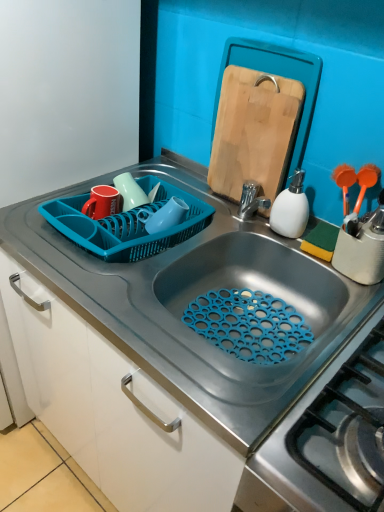
Question: Considering the relative sizes of matte red mug at upper left, acting as the first tableware starting from the left, and matte ceramic mugs at upper center, which appears as the first tableware when viewed from the right, in the image provided, is matte red mug at upper left, acting as the first tableware starting from the left, bigger than matte ceramic mugs at upper center, which appears as the first tableware when viewed from the right,?

Choices:
 (A) no
 (B) yes

Answer: (A)

Question: Is matte red mug at upper left, acting as the first tableware starting from the left, turned away from matte ceramic mugs at upper center, placed as the second tableware when sorted from left to right?

Choices:
 (A) no
 (B) yes

Answer: (B)

Question: Is matte red mug at upper left, acting as the first tableware starting from the left, not within matte ceramic mugs at upper center, which appears as the first tableware when viewed from the right?

Choices:
 (A) no
 (B) yes

Answer: (B)

Question: Considering the relative sizes of matte red mug at upper left, the 2th tableware positioned from the right, and matte ceramic mugs at upper center, which appears as the first tableware when viewed from the right, in the image provided, is matte red mug at upper left, the 2th tableware positioned from the right, thinner than matte ceramic mugs at upper center, which appears as the first tableware when viewed from the right,?

Choices:
 (A) yes
 (B) no

Answer: (B)

Question: From a real-world perspective, is matte red mug at upper left, the 2th tableware positioned from the right, positioned over matte ceramic mugs at upper center, which appears as the first tableware when viewed from the right, based on gravity?

Choices:
 (A) no
 (B) yes

Answer: (A)

Question: Is matte red mug at upper left, acting as the first tableware starting from the left, closer to camera compared to matte ceramic mugs at upper center, which appears as the first tableware when viewed from the right?

Choices:
 (A) yes
 (B) no

Answer: (A)

Question: Does wooden cutting board at upper right have a larger size compared to white matte soap dispenser at right?

Choices:
 (A) no
 (B) yes

Answer: (B)

Question: Considering the relative sizes of wooden cutting board at upper right and white matte soap dispenser at right in the image provided, is wooden cutting board at upper right thinner than white matte soap dispenser at right?

Choices:
 (A) yes
 (B) no

Answer: (A)

Question: From the image's perspective, is wooden cutting board at upper right over white matte soap dispenser at right?

Choices:
 (A) yes
 (B) no

Answer: (A)

Question: Does wooden cutting board at upper right have a greater width compared to white matte soap dispenser at right?

Choices:
 (A) no
 (B) yes

Answer: (A)

Question: Is wooden cutting board at upper right at the right side of white matte soap dispenser at right?

Choices:
 (A) yes
 (B) no

Answer: (B)

Question: Can you confirm if wooden cutting board at upper right is smaller than white matte soap dispenser at right?

Choices:
 (A) no
 (B) yes

Answer: (A)

Question: Considering the relative sizes of smooth gray countertop at center and wooden cutting board at upper right in the image provided, is smooth gray countertop at center shorter than wooden cutting board at upper right?

Choices:
 (A) yes
 (B) no

Answer: (B)